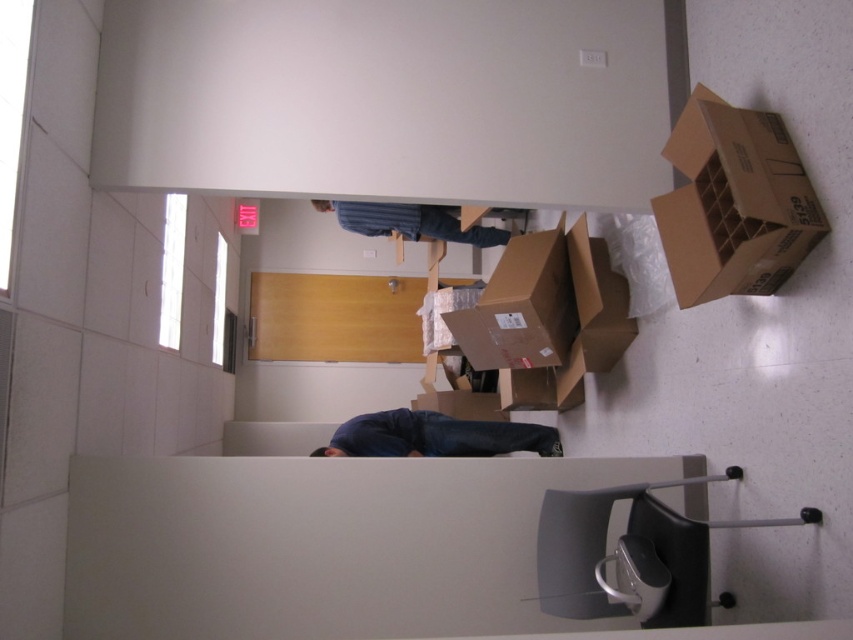
You are standing in an office and need to reach the brown cardboard box at upper right. The office has a 2.0 meter wide door. Can you carry the box through the door without tilting it?

The distance of brown cardboard box at upper right from viewer is 2.18 meters. This distance indicates the box is 2.18 meters away, but the door width is 2.0 meters. Since the box width is not provided, we can only confirm the distance. However, if the box itself is narrower than 2.0 meters, it could fit. The given information doesn not specify the box dimensions, so we cannot determine if it fits through the door width.

You are moving boxes in an office and need to fit a brown cardboard box at center through a doorway that is the same width as the blue denim jeans at upper center. Will the box fit through the doorway?

The brown cardboard box at center is narrower than the blue denim jeans at upper center, so it will fit through the doorway of the same width.